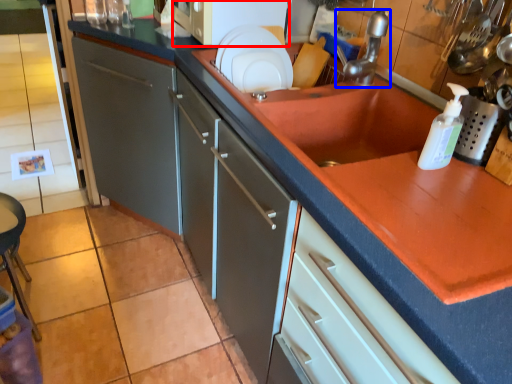
Question: Which point is closer to the camera, microwave (highlighted by a red box) or tap (highlighted by a blue box)?

Choices:
 (A) microwave
 (B) tap

Answer: (B)